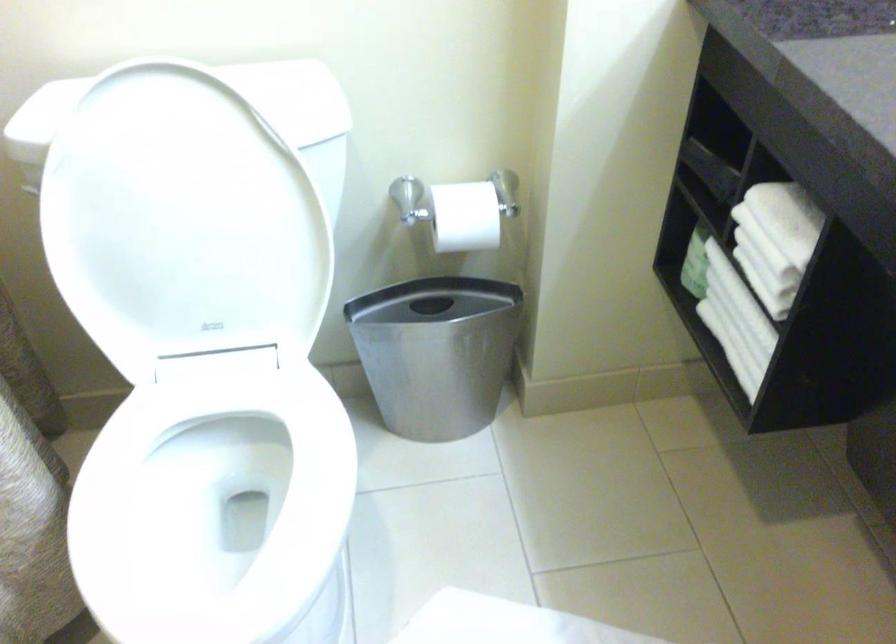
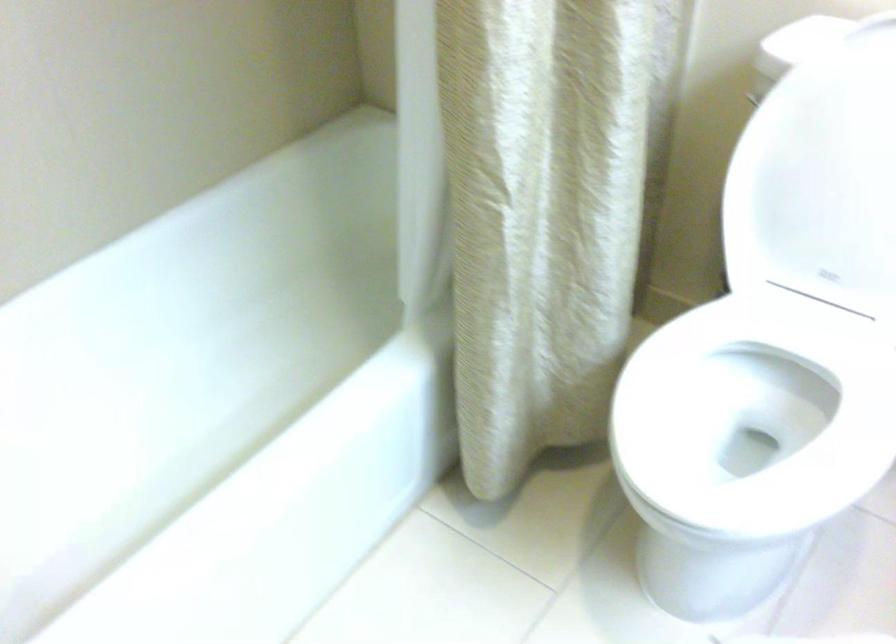
Where in the second image is the point corresponding to point (234, 484) from the first image?

(752, 420)